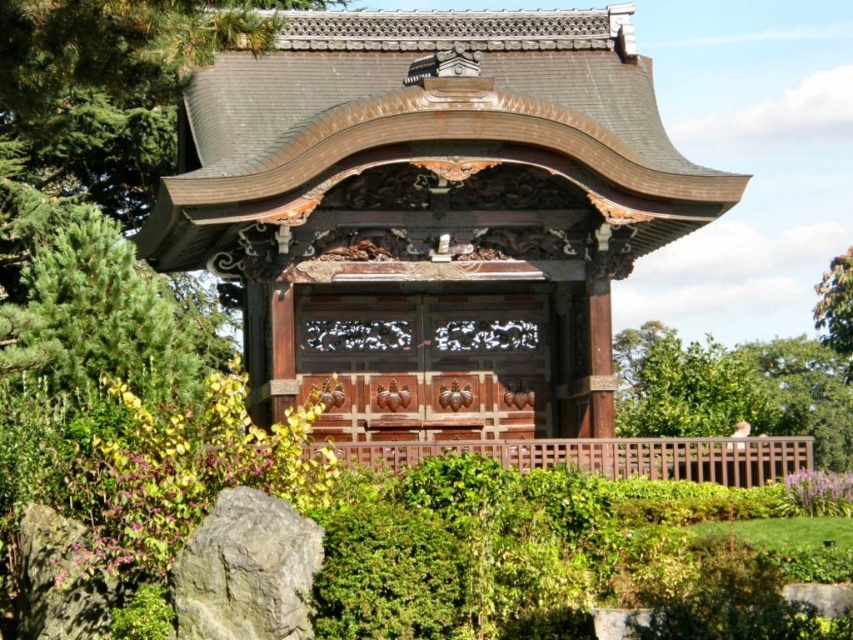
You are a landscape architect designing a garden pathway. You need to place a decorative stone near the polished wood gazebo at center. Considering the gray rough rock at lower left is already there, where should you place the new stone to avoid blocking the view of the gazebo?

The polished wood gazebo at center is positioned over the gray rough rock at lower left, so placing the new stone behind or to the side of the gray rough rock at lower left would avoid blocking the gazebo view.

You are planning to place a new decorative item in the garden. The item requires a space wider than the gray rough rock at lower left. Can the polished wood gazebo at center accommodate this item? Please explain your reasoning based on the available space.

The polished wood gazebo at center has a width larger than the gray rough rock at lower left. Since the item requires a space wider than the gray rough rock at lower left, the gazebo can accommodate it because its width is sufficient to meet the requirement.

You are a visitor standing at the entrance of the garden. You see the polished wood gazebo at center and the gray rough rock at lower left. Which object is taller from your viewpoint?

The polished wood gazebo at center is taller than the gray rough rock at lower left.